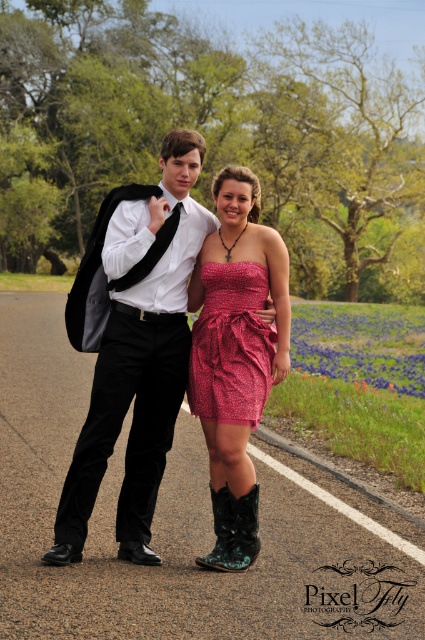
You are a photographer setting up for a couple photo shoot. You need to position a small prop between the sparkly red dress at center and the black satin tie at center so that it is closer to the taller object. Where should you place the prop?

The sparkly red dress at center is taller than the black satin tie at center, so you should place the prop closer to the sparkly red dress at center.

You are a photographer setting up for a formal outdoor photoshoot. You have two items to place on a table in the background for the scene. The shiny black suit at center and the black satin tie at center. The table has limited space. Which item should you place first to ensure both fit?

The shiny black suit at center is bigger than the black satin tie at center, so you should place the shiny black suit at center first to accommodate its larger size before placing the smaller black satin tie at center.

From the picture: You are a photographer trying to adjust the lighting for the couple in the image. Since the sparkly red dress at center and the black satin tie at center are both in the center, which one is closer to the camera? Please explain your reasoning based on their positions.

The sparkly red dress at center is in front of the black satin tie at center, so the sparkly red dress at center is closer to the camera.